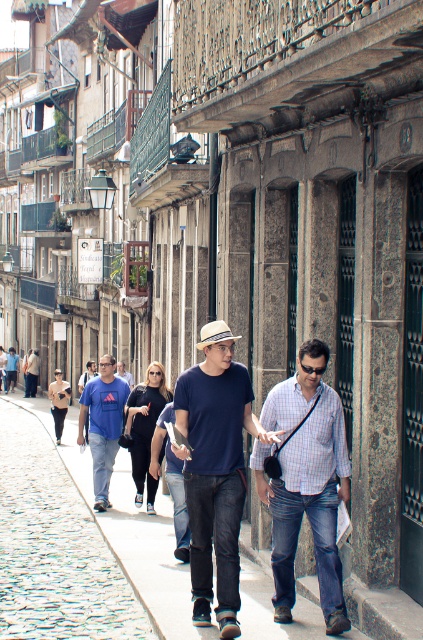
Can you confirm if cobblestone pavement at center is shorter than blue cotton t-shirt at center?

Yes.

Does point (87, 476) come behind point (93, 426)?

Yes, point (87, 476) is farther from viewer.

Locate an element on the screen. cobblestone pavement at center is located at coordinates (150, 556).

Describe the element at coordinates (216, 476) in the screenshot. I see `matte blue shirt at center` at that location.

Between point (227, 552) and point (131, 380), which one is positioned in front?

Positioned in front is point (227, 552).

Image resolution: width=423 pixels, height=640 pixels. I want to click on matte blue shirt at center, so click(216, 476).

Between blue cotton t-shirt at center and white felt fedora at center, which one appears on the right side from the viewer's perspective?

white felt fedora at center is more to the right.

Who is more distant from viewer, (110, 428) or (206, 330)?

Point (110, 428)

The height and width of the screenshot is (640, 423). Identify the location of blue cotton t-shirt at center. (102, 424).